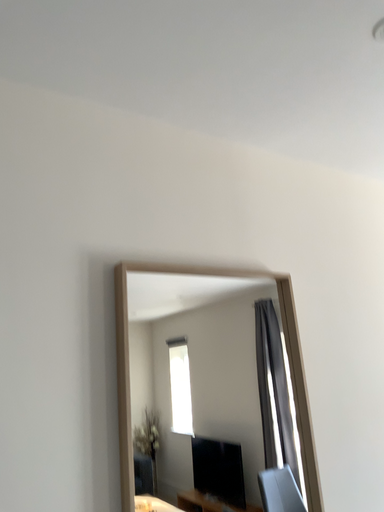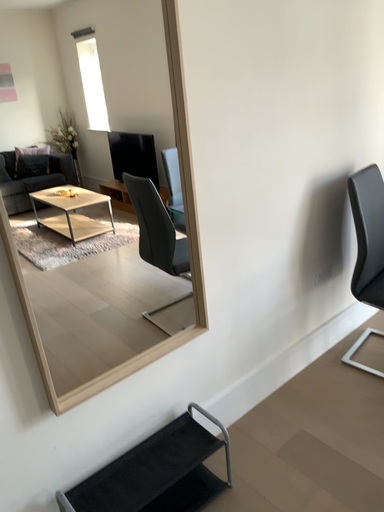
Question: Which way did the camera rotate in the video?

Choices:
 (A) rotated right
 (B) rotated left

Answer: (A)